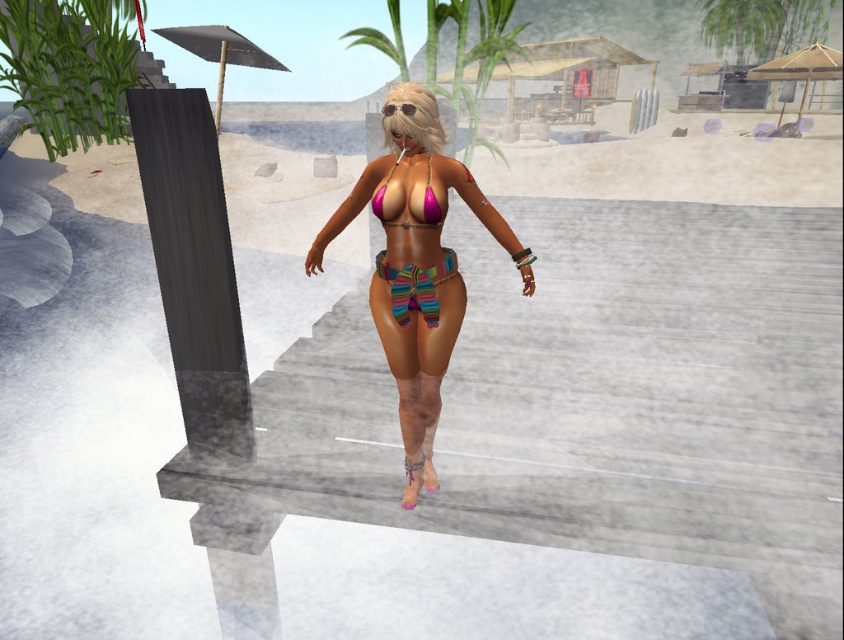
Question: Does multicolored striped bikini at center appear under gray matte umbrella at upper left?

Choices:
 (A) no
 (B) yes

Answer: (B)

Question: Estimate the real-world distances between objects in this image. Which object is closer to the multicolored fabric bikini at center?

Choices:
 (A) dark gray textured pillar at left
 (B) pink matte bikini top at center
 (C) multicolored striped bikini at center

Answer: (C)

Question: Which of the following is the farthest from the observer?

Choices:
 (A) (758, 72)
 (B) (414, 195)

Answer: (A)

Question: In this image, where is multicolored striped bikini at center located relative to gray matte umbrella at upper left?

Choices:
 (A) right
 (B) left

Answer: (A)

Question: Is beige fabric umbrella at upper center positioned before pink matte bikini top at center?

Choices:
 (A) no
 (B) yes

Answer: (A)

Question: Among these objects, which one is nearest to the camera?

Choices:
 (A) dark gray textured pillar at left
 (B) beige fabric umbrella at upper center
 (C) pink matte bikini top at center
 (D) multicolored striped bikini at center

Answer: (A)